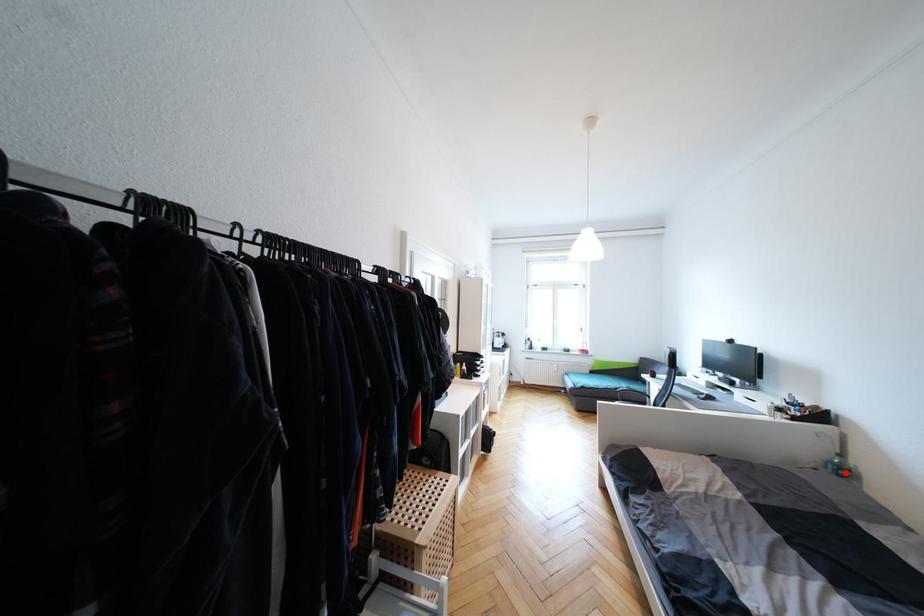
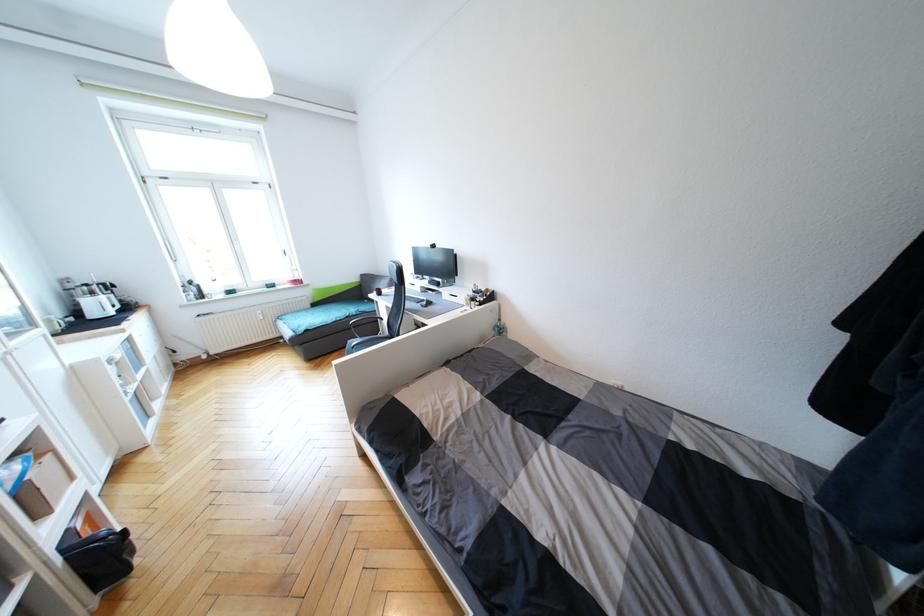
Locate, in the second image, the point that corresponds to the highlighted location in the first image.

(504, 331)